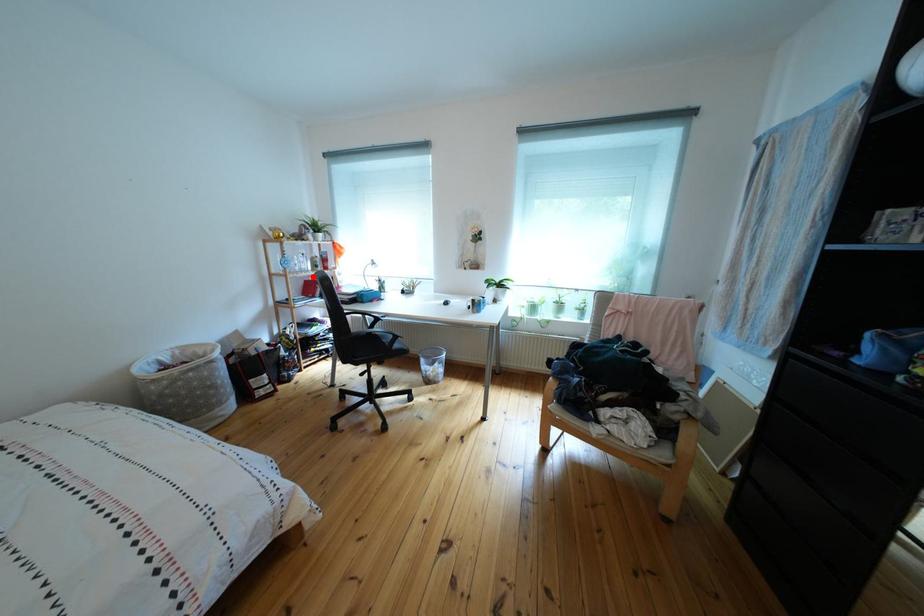
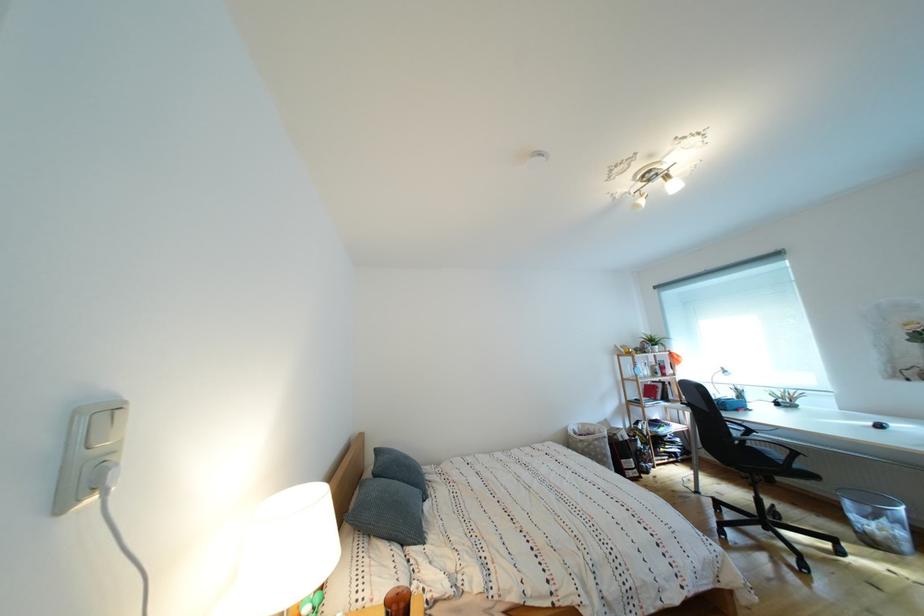
The point at the highlighted location is marked in the first image. Where is the corresponding point in the second image?

(657, 383)